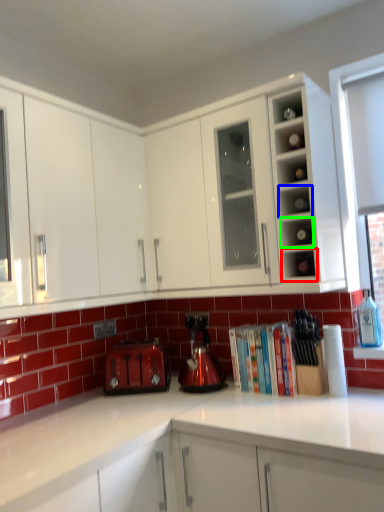
Question: Estimate the real-world distances between objects in this image. Which object is closer to shelf (highlighted by a red box), shelf (highlighted by a blue box) or shelf (highlighted by a green box)?

Choices:
 (A) shelf
 (B) shelf

Answer: (B)